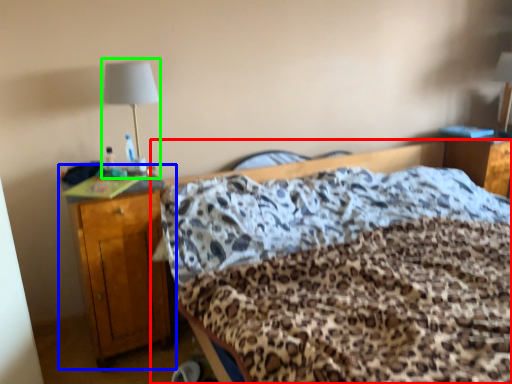
Question: Based on their relative distances, which object is farther from bed (highlighted by a red box)? Choose from nightstand (highlighted by a blue box) and bedside lamp (highlighted by a green box).

Choices:
 (A) nightstand
 (B) bedside lamp

Answer: (B)